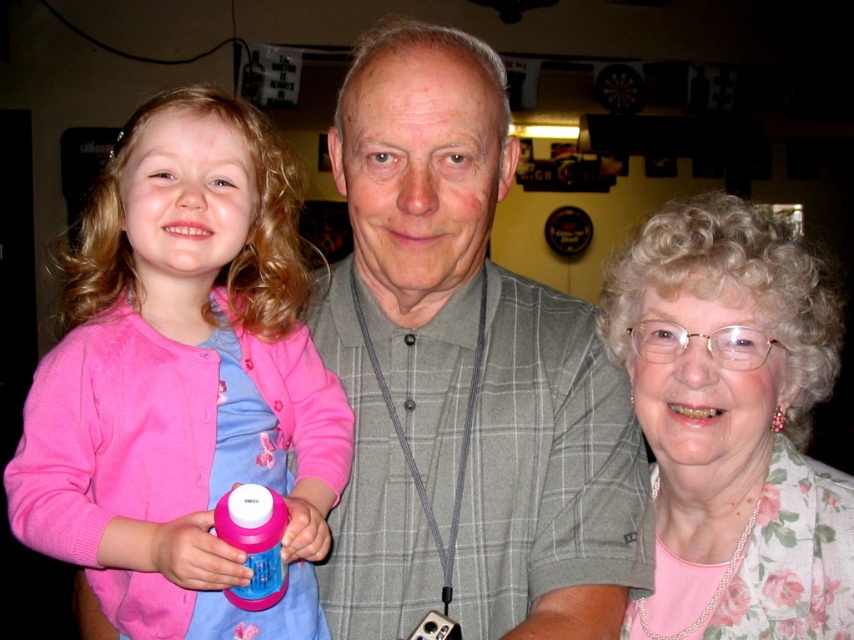
Does gray plaid shirt at center lie in front of pink fleece sweater at left?

That is False.

Which is above, gray plaid shirt at center or pink fleece sweater at left?

gray plaid shirt at center

Locate an element on the screen. The image size is (854, 640). gray plaid shirt at center is located at coordinates (463, 376).

Where is `gray plaid shirt at center`? Image resolution: width=854 pixels, height=640 pixels. gray plaid shirt at center is located at coordinates (463, 376).

Can you confirm if pink fleece sweater at left is bigger than floral-patterned blouse at right?

Indeed, pink fleece sweater at left has a larger size compared to floral-patterned blouse at right.

Is pink fleece sweater at left below floral-patterned blouse at right?

Actually, pink fleece sweater at left is above floral-patterned blouse at right.

Is point (161, 582) positioned in front of point (740, 621)?

Yes, it is.

I want to click on pink fleece sweater at left, so click(178, 369).

Can you confirm if gray plaid shirt at center is shorter than floral-patterned blouse at right?

No.

Is point (560, 483) positioned after point (658, 236)?

Yes, it is.

Locate an element on the screen. The height and width of the screenshot is (640, 854). gray plaid shirt at center is located at coordinates (463, 376).